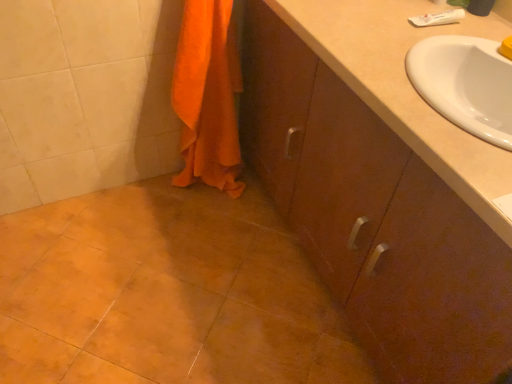
At what (x,y) coordinates should I click in order to perform the action: click on free point below orange cotton towel at lower left (from a real-world perspective). Please return your answer as a coordinate pair (x, y). The width and height of the screenshot is (512, 384). Looking at the image, I should click on (205, 191).